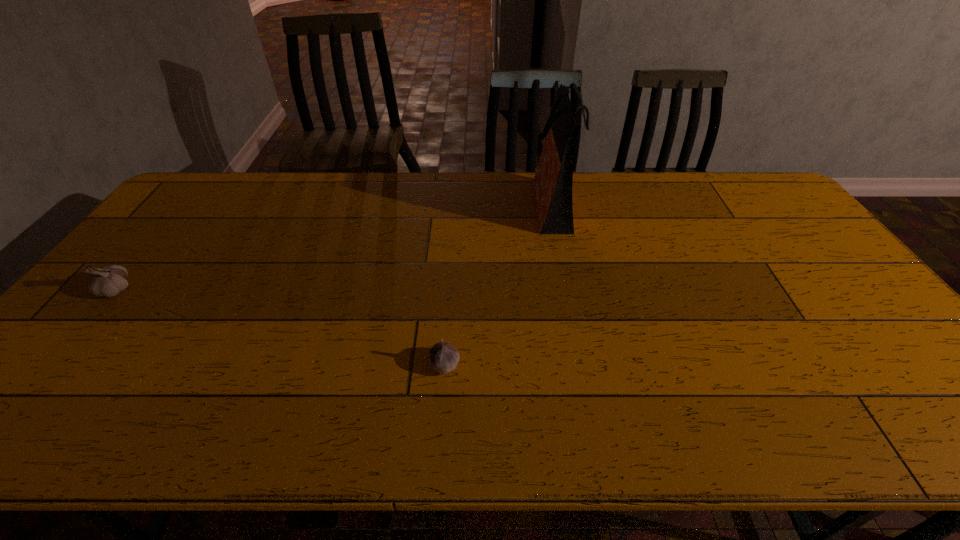
Identify the location of the farthest object. (552, 185).

The height and width of the screenshot is (540, 960). What are the coordinates of `the rightmost object` in the screenshot? It's located at (552, 185).

This screenshot has height=540, width=960. What are the coordinates of `the second tallest object` in the screenshot? It's located at (108, 281).

Locate an element on the screen. Image resolution: width=960 pixels, height=540 pixels. the left garlic is located at coordinates (108, 281).

Find the location of a particular element. the nearest object is located at coordinates 443,357.

Find the location of a particular element. the shortest object is located at coordinates (x=443, y=357).

You are a GUI agent. You are given a task and a screenshot of the screen. Output one action in this format:
    pyautogui.click(x=<x>, y=<y>)
    Task: Click on the vacant area located on the front side of the shopping bag
    
    Given the screenshot: What is the action you would take?
    pyautogui.click(x=477, y=204)

Identify the location of vacant region located 0.400m on the front side of the shopping bag. The image size is (960, 540). (413, 204).

I want to click on vacant space located 0.090m on the front side of the shopping bag, so click(503, 204).

Locate an element on the screen. This screenshot has height=540, width=960. free space located 0.250m on the front of the second shortest object is located at coordinates (39, 383).